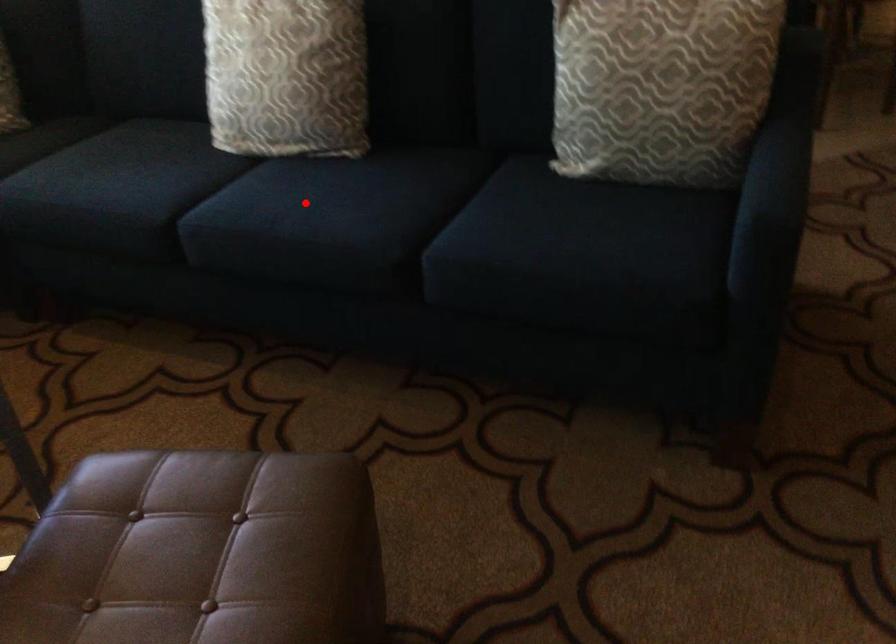
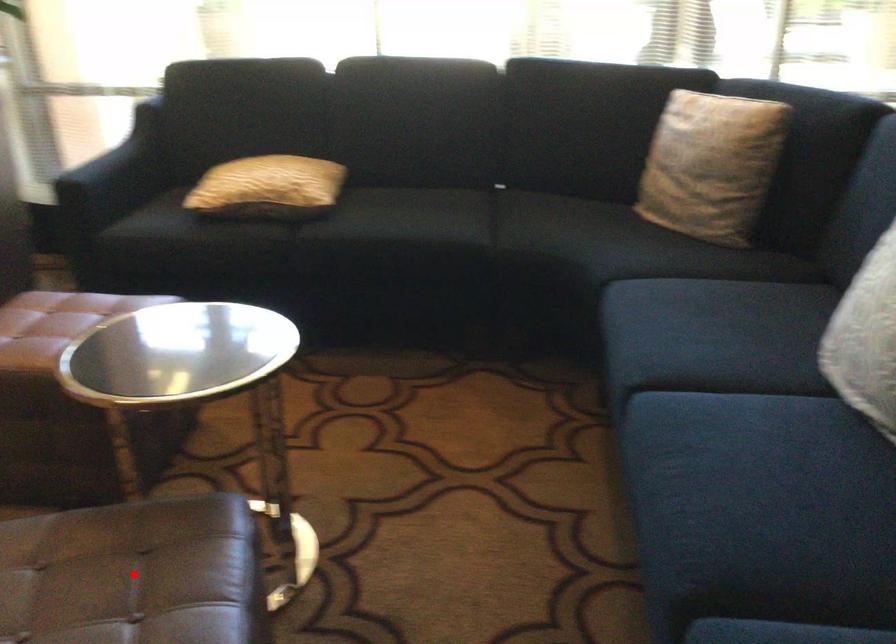
I am providing you with two images of the same scene from different viewpoints. A red point is marked on the first image and another point is marked on the second image. Is the marked point in image1 the same physical position as the marked point in image2?

No